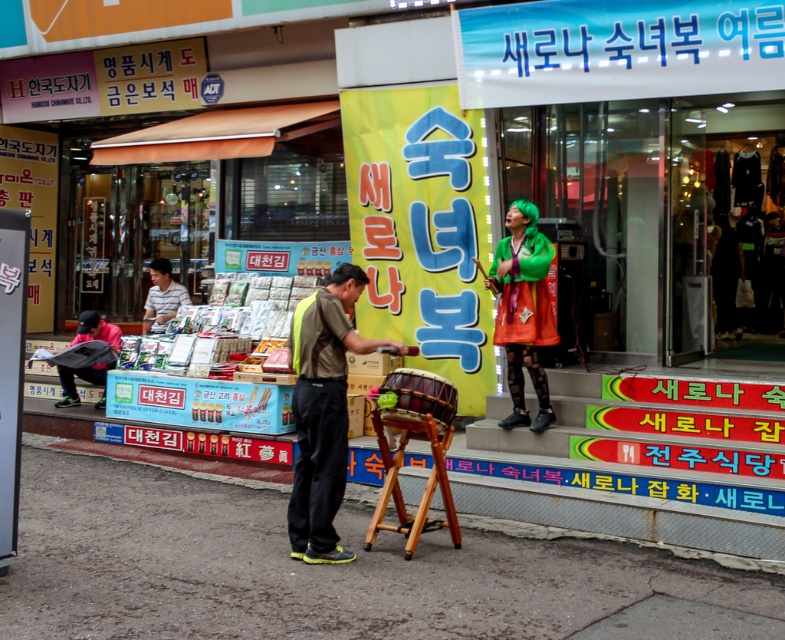
Question: Which object is the closest to the wooden stool at center?

Choices:
 (A) brown fabric street vendor at center
 (B) concrete pavement at lower center
 (C) matte black jacket at left
 (D) green felt hat at upper center

Answer: (A)

Question: Is the position of green felt hat at upper center less distant than that of matte black jacket at left?

Choices:
 (A) yes
 (B) no

Answer: (A)

Question: Can you confirm if matte black jacket at left is positioned below striped shirt at center?

Choices:
 (A) yes
 (B) no

Answer: (A)

Question: Can you confirm if concrete pavement at lower center is positioned above brown fabric street vendor at center?

Choices:
 (A) no
 (B) yes

Answer: (A)

Question: Which object is farther from the camera taking this photo?

Choices:
 (A) concrete pavement at lower center
 (B) wooden stool at center

Answer: (B)

Question: Which of the following is the farthest from the observer?

Choices:
 (A) (157, 285)
 (B) (325, 362)

Answer: (A)